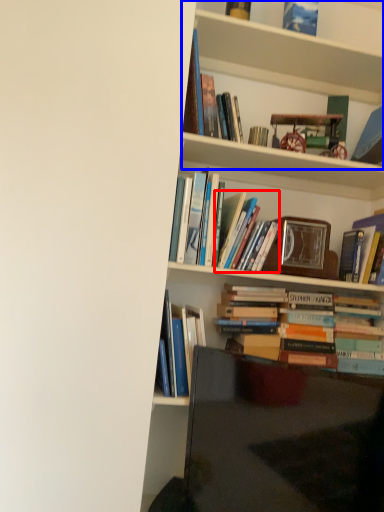
Question: Which object is closer to the camera taking this photo, book (highlighted by a red box) or shelf (highlighted by a blue box)?

Choices:
 (A) book
 (B) shelf

Answer: (B)